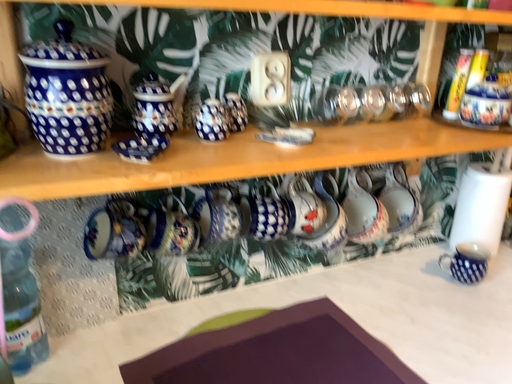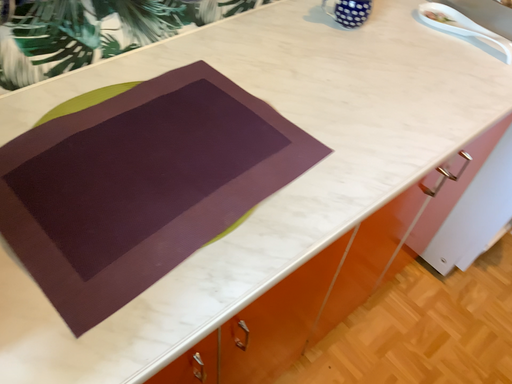
Question: How did the camera likely rotate when shooting the video?

Choices:
 (A) rotated upward
 (B) rotated downward

Answer: (B)